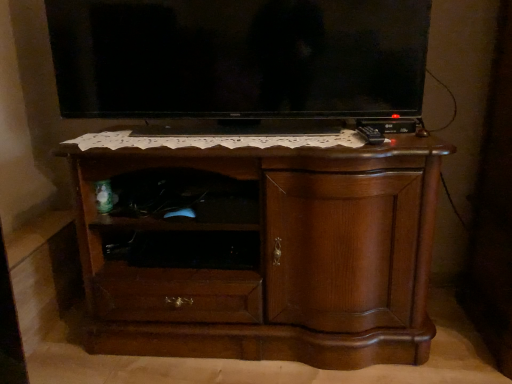
Image resolution: width=512 pixels, height=384 pixels. Find the location of `black matte shelf at center`. black matte shelf at center is located at coordinates (183, 248).

Find the location of a particular element. Image resolution: width=512 pixels, height=384 pixels. brown wood chest of drawers at center is located at coordinates (277, 258).

Is black glossy tv at upper center located within brown wood chest of drawers at center?

No, black glossy tv at upper center is not surrounded by brown wood chest of drawers at center.

Considering the relative positions of brown wood chest of drawers at center and black glossy tv at upper center in the image provided, is brown wood chest of drawers at center to the right of black glossy tv at upper center from the viewer's perspective?

Indeed, brown wood chest of drawers at center is positioned on the right side of black glossy tv at upper center.

At what (x,y) coordinates should I click in order to perform the action: click on chest of drawers on the right of black glossy tv at upper center. Please return your answer as a coordinate pair (x, y). Looking at the image, I should click on (277, 258).

Which object is closer to the camera, brown wood chest of drawers at center or black glossy tv at upper center?

brown wood chest of drawers at center is closer to the camera.

Is black glossy tv at upper center facing towards brown wood chest of drawers at center?

No, black glossy tv at upper center is not turned towards brown wood chest of drawers at center.

Is black glossy tv at upper center to the left of brown wood chest of drawers at center from the viewer's perspective?

Correct, you'll find black glossy tv at upper center to the left of brown wood chest of drawers at center.

What's the angular difference between black glossy tv at upper center and brown wood chest of drawers at center's facing directions?

2.13 degrees.

From the image's perspective, is black glossy tv at upper center on brown wood chest of drawers at center?

Yes, from the image's perspective, black glossy tv at upper center is over brown wood chest of drawers at center.

Who is bigger, black matte shelf at center or brown wood chest of drawers at center?

With larger size is brown wood chest of drawers at center.

You are a GUI agent. You are given a task and a screenshot of the screen. Output one action in this format:
    pyautogui.click(x=<x>, y=<y>)
    Task: Click on the shelf lying behind the brown wood chest of drawers at center
    
    Given the screenshot: What is the action you would take?
    pyautogui.click(x=183, y=248)

Is black matte shelf at center looking in the opposite direction of brown wood chest of drawers at center?

Absolutely, black matte shelf at center is directed away from brown wood chest of drawers at center.

Can you confirm if black matte shelf at center is thinner than brown wood chest of drawers at center?

Yes, black matte shelf at center is thinner than brown wood chest of drawers at center.

How many degrees apart are the facing directions of black matte shelf at center and black glossy tv at upper center?

0.0584 degrees.

Which point is more forward, (x=184, y=243) or (x=152, y=90)?

Positioned in front is point (x=184, y=243).

From a real-world perspective, is black matte shelf at center physically above black glossy tv at upper center?

No, from a real-world perspective, black matte shelf at center is not on top of black glossy tv at upper center.

Is black matte shelf at center further to the viewer compared to black glossy tv at upper center?

Yes, it is.

Looking at their sizes, would you say brown wood chest of drawers at center is wider or thinner than black matte shelf at center?

In the image, brown wood chest of drawers at center appears to be wider than black matte shelf at center.

Is the position of brown wood chest of drawers at center more distant than that of black matte shelf at center?

No, brown wood chest of drawers at center is in front of black matte shelf at center.

Between point (282, 259) and point (181, 246), which one is positioned in front?

The point (282, 259) is closer to the camera.

Is black glossy tv at upper center facing away from black matte shelf at center?

black glossy tv at upper center is not turned away from black matte shelf at center.

Based on their sizes in the image, would you say black glossy tv at upper center is bigger or smaller than black matte shelf at center?

Clearly, black glossy tv at upper center is larger in size than black matte shelf at center.

Is black glossy tv at upper center positioned far away from black matte shelf at center?

That's not correct — black glossy tv at upper center is a little close to black matte shelf at center.

In the image, there is a black glossy tv at upper center. Identify the location of the chest of drawers below it (from a real-world perspective). (277, 258).

Identify the location of television that is above the brown wood chest of drawers at center (from the image's perspective). (239, 58).

When comparing their distances from black glossy tv at upper center, does brown wood chest of drawers at center or black matte shelf at center seem closer?

brown wood chest of drawers at center is closer to black glossy tv at upper center.

From the image, which object appears to be nearer to black glossy tv at upper center, black matte shelf at center or brown wood chest of drawers at center?

brown wood chest of drawers at center lies closer to black glossy tv at upper center than the other object.

In the scene shown: Which object lies further to the anchor point brown wood chest of drawers at center, black glossy tv at upper center or black matte shelf at center?

black glossy tv at upper center lies further to brown wood chest of drawers at center than the other object.

Looking at the image, which one is located further to brown wood chest of drawers at center, black matte shelf at center or black glossy tv at upper center?

black glossy tv at upper center is positioned further to the anchor brown wood chest of drawers at center.

Which object lies further to the anchor point black matte shelf at center, black glossy tv at upper center or brown wood chest of drawers at center?

black glossy tv at upper center is positioned further to the anchor black matte shelf at center.

From the picture: Looking at the image, which one is located further to black matte shelf at center, brown wood chest of drawers at center or black glossy tv at upper center?

black glossy tv at upper center is further to black matte shelf at center.

What are the coordinates of `the chest of drawers between black glossy tv at upper center and black matte shelf at center vertically` in the screenshot? It's located at (277, 258).